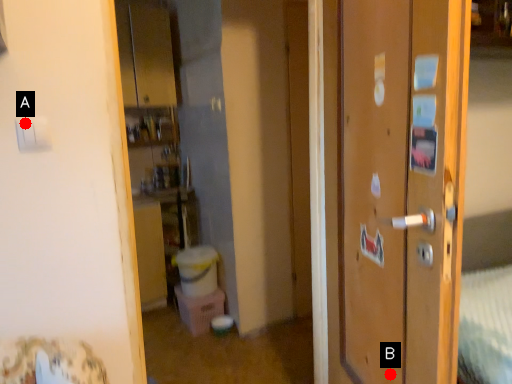
Question: Two points are circled on the image, labeled by A and B beside each circle. Which point is farther from the camera taking this photo?

Choices:
 (A) A is further
 (B) B is further

Answer: (B)